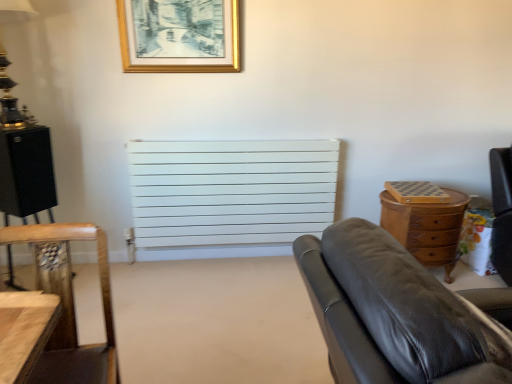
Question: Would you consider gold metallic lamp at upper left to be distant from white matte radiator at center?

Choices:
 (A) no
 (B) yes

Answer: (B)

Question: Does gold metallic lamp at upper left have a lesser width compared to white matte radiator at center?

Choices:
 (A) yes
 (B) no

Answer: (B)

Question: From the image's perspective, is gold metallic lamp at upper left below white matte radiator at center?

Choices:
 (A) no
 (B) yes

Answer: (A)

Question: Is gold metallic lamp at upper left at the right side of white matte radiator at center?

Choices:
 (A) no
 (B) yes

Answer: (A)

Question: Could you tell me if gold metallic lamp at upper left is facing white matte radiator at center?

Choices:
 (A) yes
 (B) no

Answer: (B)

Question: Is gold metallic lamp at upper left inside the boundaries of wooden chair at lower left, or outside?

Choices:
 (A) outside
 (B) inside

Answer: (A)

Question: Considering the positions of gold metallic lamp at upper left and wooden chair at lower left in the image, is gold metallic lamp at upper left wider or thinner than wooden chair at lower left?

Choices:
 (A) wide
 (B) thin

Answer: (B)

Question: From their relative heights in the image, would you say gold metallic lamp at upper left is taller or shorter than wooden chair at lower left?

Choices:
 (A) tall
 (B) short

Answer: (B)

Question: In the image, is gold metallic lamp at upper left positioned in front of or behind wooden chair at lower left?

Choices:
 (A) behind
 (B) front

Answer: (A)

Question: Is black leather couch at right inside the boundaries of wooden chair at lower left, or outside?

Choices:
 (A) outside
 (B) inside

Answer: (A)

Question: Considering their positions, is black leather couch at right located in front of or behind wooden chair at lower left?

Choices:
 (A) front
 (B) behind

Answer: (A)

Question: From the image's perspective, relative to wooden chair at lower left, is black leather couch at right above or below?

Choices:
 (A) below
 (B) above

Answer: (B)

Question: Based on their positions, is black leather couch at right located to the left or right of wooden chair at lower left?

Choices:
 (A) right
 (B) left

Answer: (A)

Question: Is point (86, 380) closer or farther from the camera than point (14, 117)?

Choices:
 (A) closer
 (B) farther

Answer: (A)

Question: Looking at the image, does wooden chair at lower left seem bigger or smaller compared to gold metallic lamp at upper left?

Choices:
 (A) small
 (B) big

Answer: (B)